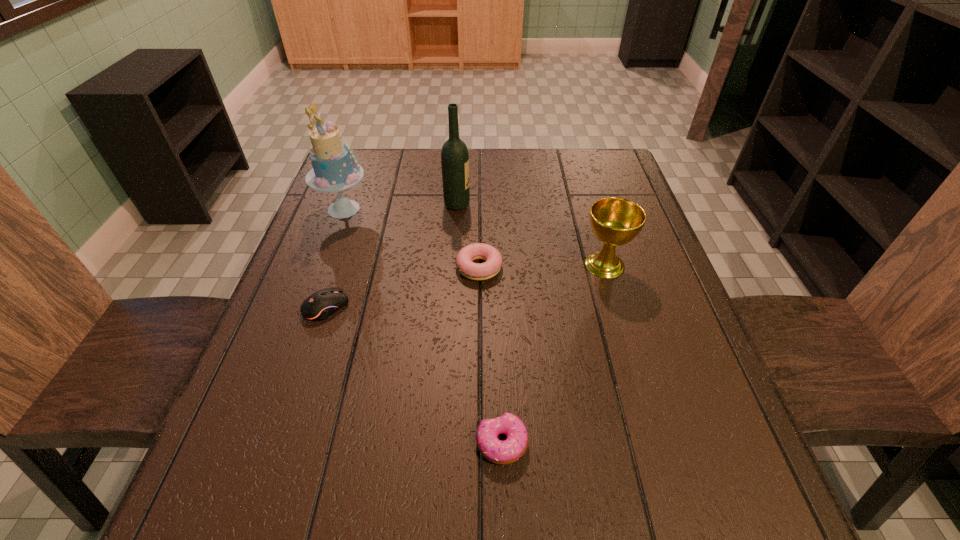
Image resolution: width=960 pixels, height=540 pixels. I want to click on free space at the far right corner, so click(570, 160).

Where is `free space between the farther doughnut and the second nearest object`? The image size is (960, 540). free space between the farther doughnut and the second nearest object is located at coordinates (403, 287).

This screenshot has height=540, width=960. I want to click on vacant region between the farther doughnut and the computer mouse, so click(403, 287).

Find the location of a particular element. The width and height of the screenshot is (960, 540). free space between the wine bottle and the third tallest object is located at coordinates (531, 235).

The width and height of the screenshot is (960, 540). In order to click on vacant space in between the farther doughnut and the computer mouse in this screenshot , I will do `click(403, 287)`.

The height and width of the screenshot is (540, 960). What are the coordinates of `vacant space that's between the farther doughnut and the second nearest object` in the screenshot? It's located at (403, 287).

Where is `free space between the nearer doughnut and the chalice`? free space between the nearer doughnut and the chalice is located at coordinates (553, 354).

At what (x,y) coordinates should I click in order to perform the action: click on free spot between the farther doughnut and the wine bottle. Please return your answer as a coordinate pair (x, y). This screenshot has width=960, height=540. Looking at the image, I should click on (468, 236).

Locate an element on the screen. The height and width of the screenshot is (540, 960). empty location between the nearest object and the cake is located at coordinates (422, 326).

Identify the location of vacant space that's between the cake and the fourth shortest object. This screenshot has width=960, height=540. [x=474, y=237].